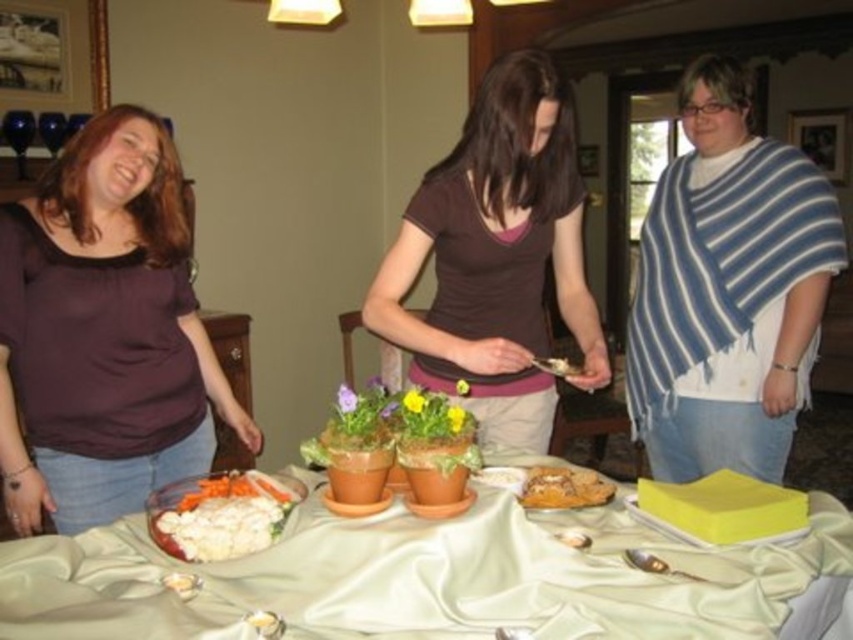
Question: Which point is farther to the camera?

Choices:
 (A) (585, 499)
 (B) (793, 324)

Answer: (B)

Question: Is brown matte shirt at center below white creamy salad at lower left?

Choices:
 (A) no
 (B) yes

Answer: (A)

Question: Which point is closer to the camera?

Choices:
 (A) (271, 541)
 (B) (546, 492)
 (C) (637, 522)
 (D) (146, 376)

Answer: (A)

Question: Is silky white tablecloth at center to the right of golden brown bread at center from the viewer's perspective?

Choices:
 (A) no
 (B) yes

Answer: (A)

Question: Which of these objects is positioned closest to the silky white tablecloth at center?

Choices:
 (A) brown matte shirt at center
 (B) white creamy salad at lower left
 (C) matte purple shirt at left

Answer: (B)

Question: Is matte purple shirt at left thinner than brown matte shirt at center?

Choices:
 (A) yes
 (B) no

Answer: (A)